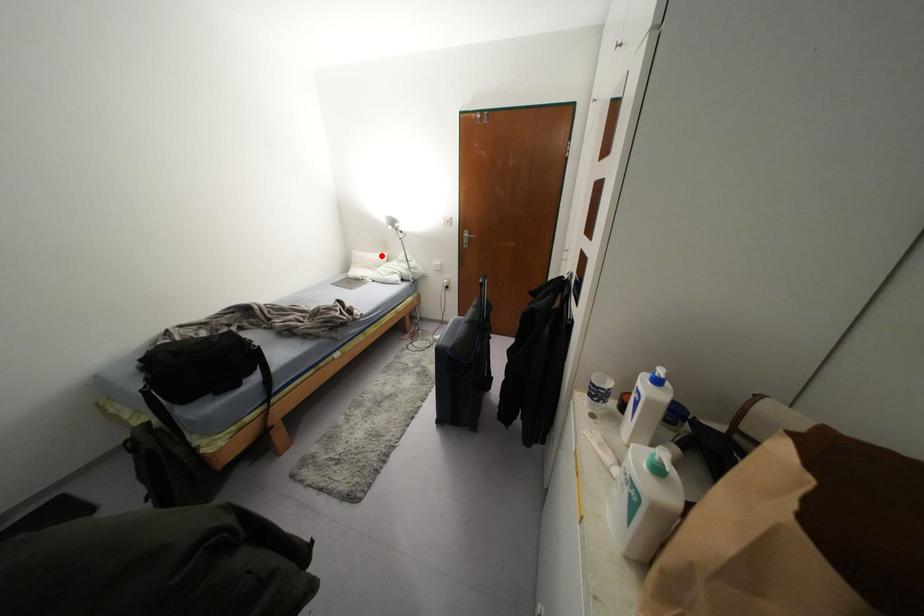
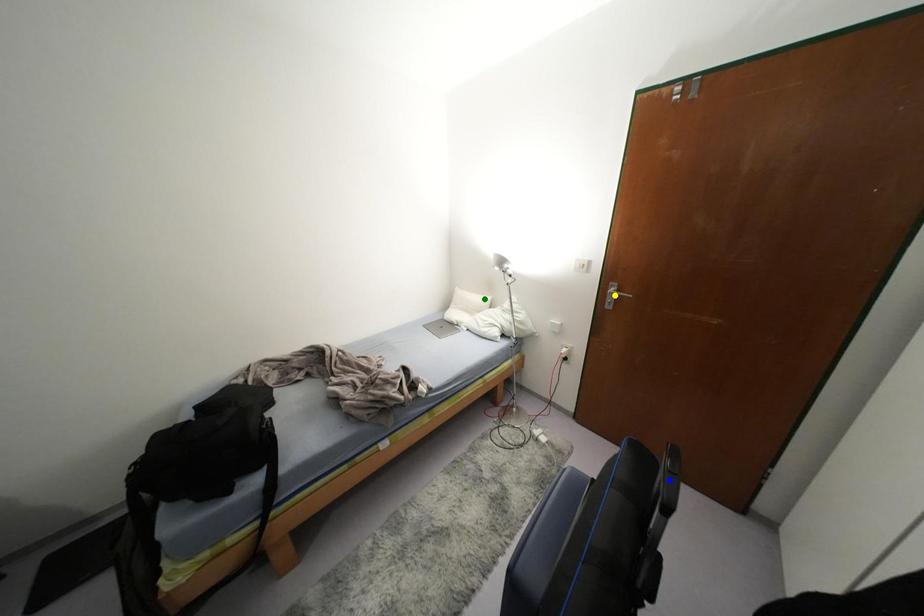
Question: I am providing you with two images of the same scene from different viewpoints. A red point is marked on the first image. You are given multiple points on the second image. In image 2, which mark is for the same physical point as the one in image 1?

Choices:
 (A) blue point
 (B) green point
 (C) yellow point

Answer: (B)